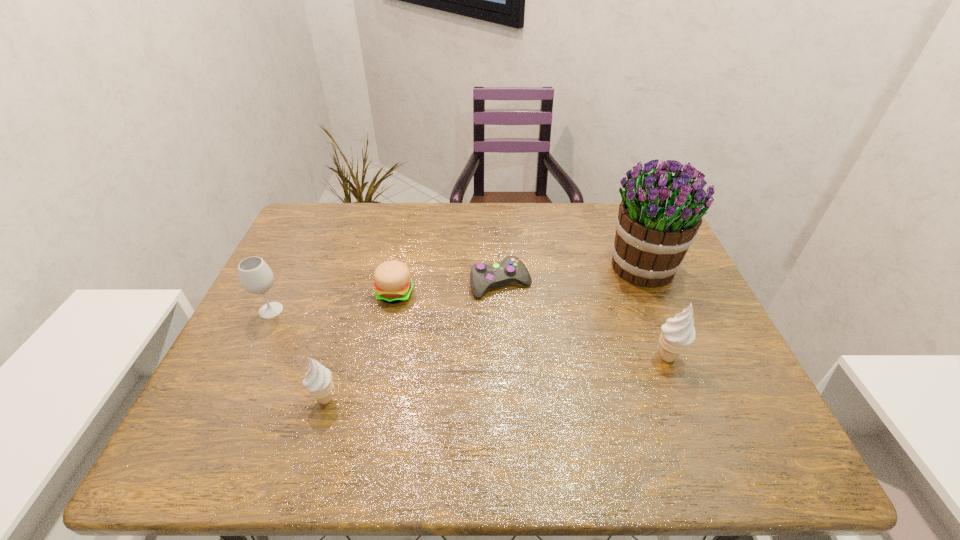
Locate an element on the screen. the nearest object is located at coordinates (318, 382).

Identify the location of the shorter icecream. (318, 382).

In order to click on the second nearest object in this screenshot , I will do `click(677, 334)`.

Identify the location of the taller icecream. [x=677, y=334].

Where is `wineglass`? The image size is (960, 540). wineglass is located at coordinates (255, 276).

The width and height of the screenshot is (960, 540). In order to click on control in this screenshot , I will do `click(482, 276)`.

You are a GUI agent. You are given a task and a screenshot of the screen. Output one action in this format:
    pyautogui.click(x=<x>, y=<y>)
    Task: Click on the fourth object from left to right
    
    Given the screenshot: What is the action you would take?
    pyautogui.click(x=482, y=276)

In order to click on bouquet in this screenshot , I will do (657, 222).

Locate an element on the screen. This screenshot has height=540, width=960. the second shortest object is located at coordinates (392, 280).

You are a GUI agent. You are given a task and a screenshot of the screen. Output one action in this format:
    pyautogui.click(x=<x>, y=<y>)
    Task: Click on the fourth object from right to left
    
    Given the screenshot: What is the action you would take?
    pyautogui.click(x=392, y=280)